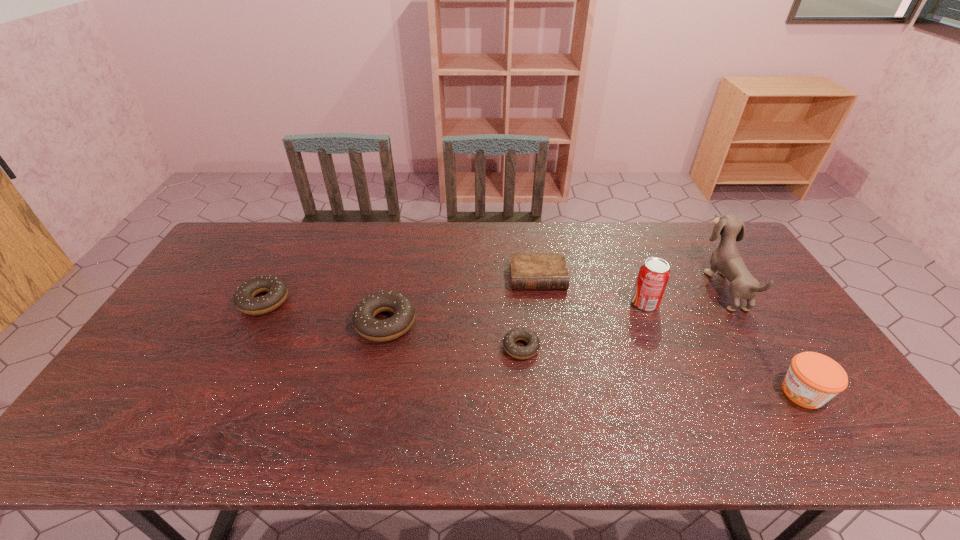
The width and height of the screenshot is (960, 540). I want to click on vacant space located 0.370m on the front label of the third tallest object, so click(631, 393).

Identify the location of vacant space located 0.380m on the front label of the third tallest object. (627, 393).

Identify the location of object at the far edge. The height and width of the screenshot is (540, 960). (726, 259).

What are the coordinates of `object present at the near edge` in the screenshot? It's located at (813, 379).

Locate an element on the screen. Image resolution: width=960 pixels, height=540 pixels. puppy at the right edge is located at coordinates (726, 259).

I want to click on jam situated at the right edge, so click(x=813, y=379).

Locate an element on the screen. The height and width of the screenshot is (540, 960). object situated at the far right corner is located at coordinates (726, 259).

Find the location of a particular element. The image size is (960, 540). object present at the near right corner is located at coordinates (813, 379).

The height and width of the screenshot is (540, 960). Find the location of `free location at the far edge of the desktop`. free location at the far edge of the desktop is located at coordinates (547, 233).

This screenshot has width=960, height=540. I want to click on vacant space at the near edge of the desktop, so click(236, 394).